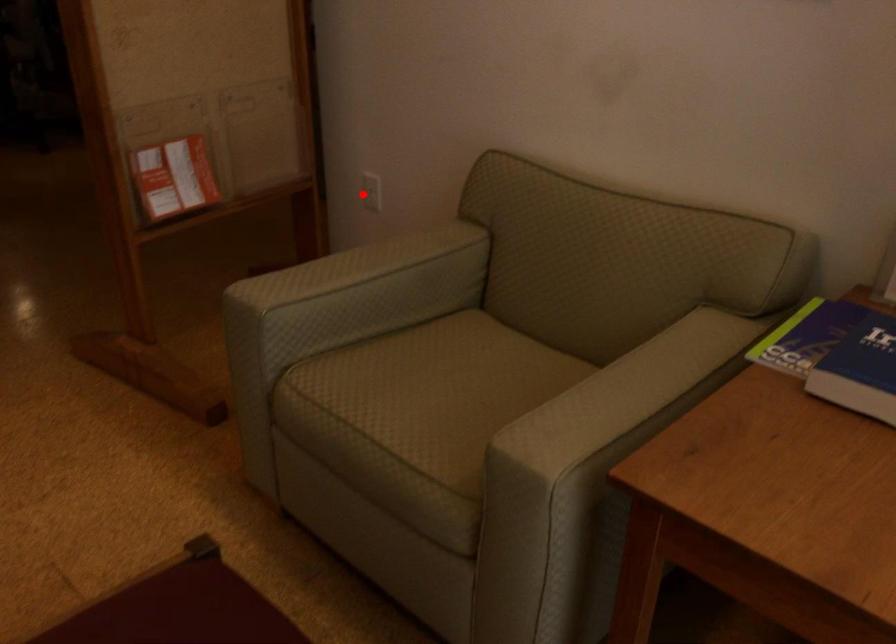
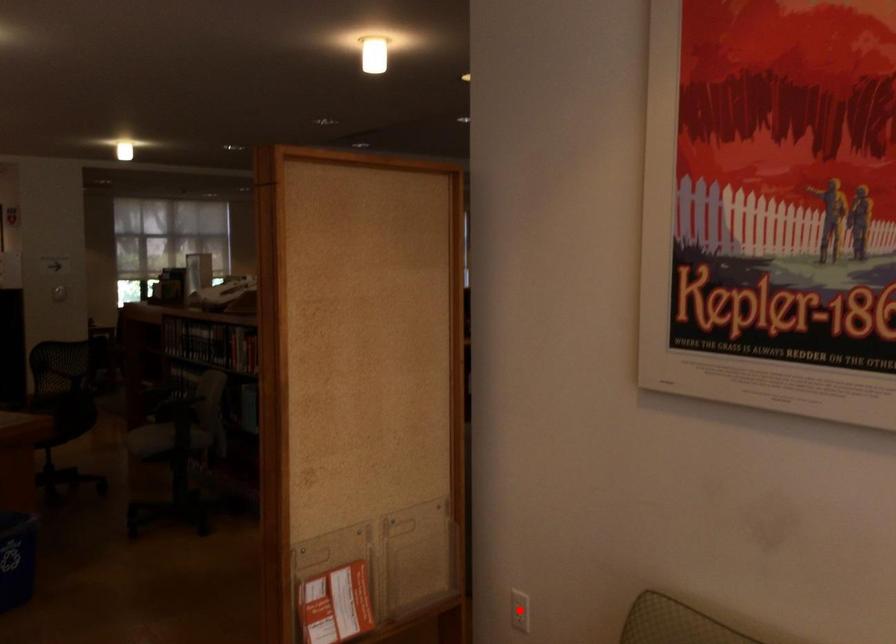
I am providing you with two images of the same scene from different viewpoints. A red point is marked on the first image and another point is marked on the second image. Are the points marked in image1 and image2 representing the same 3D position?

Yes